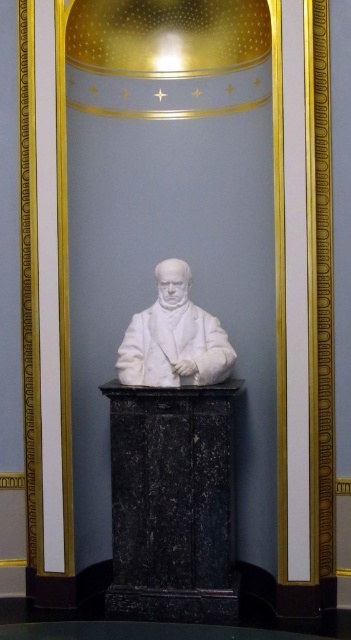
Question: Which point is farther to the camera?

Choices:
 (A) black marble pedestal at center
 (B) white marble bust at center

Answer: (A)

Question: Can you confirm if black marble pedestal at center is wider than white marble bust at center?

Choices:
 (A) yes
 (B) no

Answer: (A)

Question: Is black marble pedestal at center positioned in front of white marble bust at center?

Choices:
 (A) yes
 (B) no

Answer: (B)

Question: Which point is farther from the camera taking this photo?

Choices:
 (A) tap(137, 323)
 (B) tap(195, 608)

Answer: (A)

Question: Is black marble pedestal at center positioned behind white marble bust at center?

Choices:
 (A) yes
 (B) no

Answer: (A)